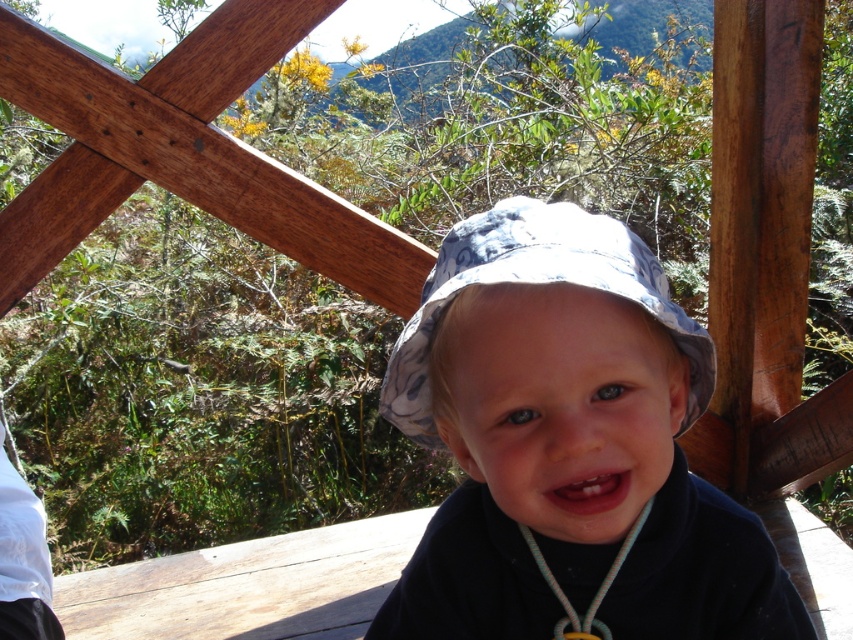
Is blue floral hat at center taller than blue floral fabric hat at center?

Yes, blue floral hat at center is taller than blue floral fabric hat at center.

Which is behind, point (645, 403) or point (605, 244)?

The point (605, 244) is more distant.

This screenshot has height=640, width=853. Find the location of `blue floral hat at center`. blue floral hat at center is located at coordinates (567, 444).

Where is `blue floral hat at center`? blue floral hat at center is located at coordinates (567, 444).

Is blue floral hat at center positioned before rope-like necklace at center?

Yes, blue floral hat at center is closer to the viewer.

Who is more distant from viewer, (531,525) or (563,628)?

Positioned behind is point (563,628).

Identify the location of blue floral hat at center. This screenshot has width=853, height=640. (567, 444).

How far apart are blue floral fabric hat at center and rope-like necklace at center?

A distance of 7.25 inches exists between blue floral fabric hat at center and rope-like necklace at center.

Between blue floral fabric hat at center and rope-like necklace at center, which one is positioned higher?

blue floral fabric hat at center is above.

At what (x,y) coordinates should I click in order to perform the action: click on blue floral fabric hat at center. Please return your answer as a coordinate pair (x, y). The height and width of the screenshot is (640, 853). Looking at the image, I should click on (537, 284).